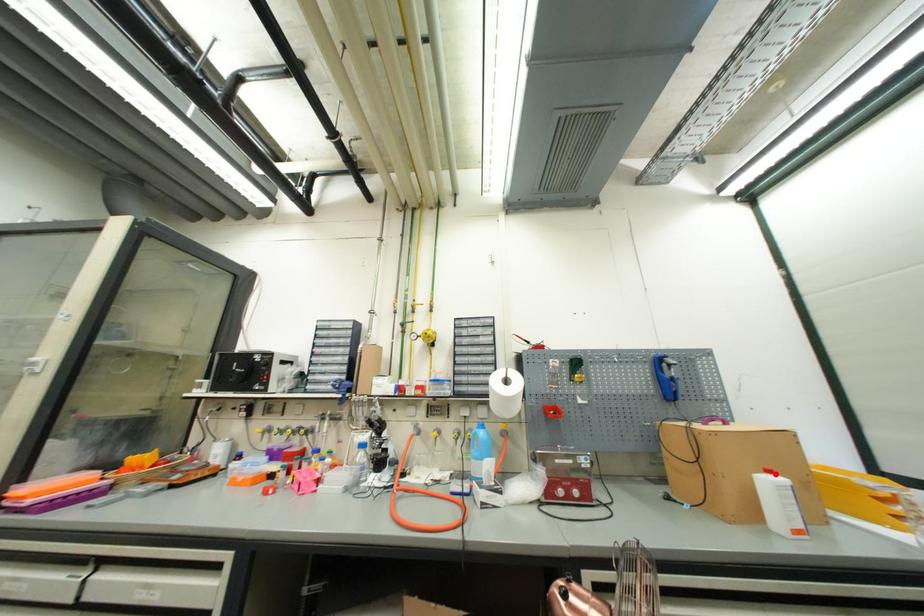
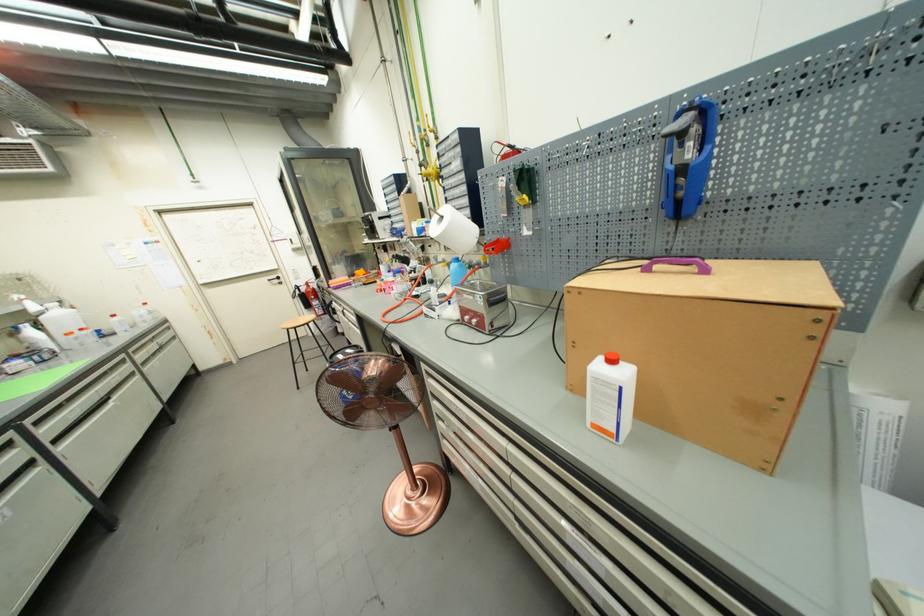
In the second image, find the point that corresponds to the highlighted location in the first image.

(617, 363)